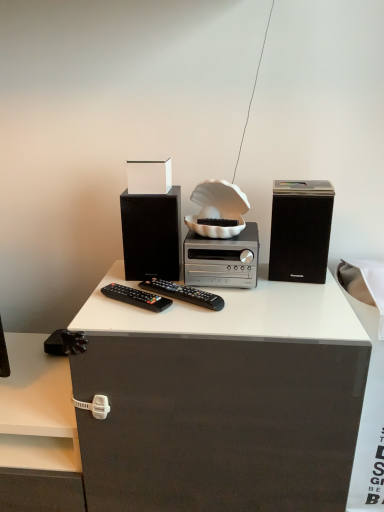
Find the location of a particular element. silver metallic stereo at center is located at coordinates (222, 259).

What do you see at coordinates (183, 293) in the screenshot? I see `black plastic remote at center, placed as the second remote control when sorted from left to right` at bounding box center [183, 293].

Describe the element at coordinates (152, 234) in the screenshot. I see `matte black speaker at center, the first speaker viewed from the left` at that location.

In order to click on silver metallic stereo at center in this screenshot , I will do `click(222, 259)`.

From a real-world perspective, is black plastic remote at center, placed as the second remote control when sorted from left to right, located higher than silver metallic stereo at center?

Incorrect, from a real-world perspective, black plastic remote at center, placed as the second remote control when sorted from left to right, is lower than silver metallic stereo at center.

Could silver metallic stereo at center be considered to be inside black plastic remote at center, placed as the second remote control when sorted from left to right?

Actually, silver metallic stereo at center is outside black plastic remote at center, placed as the second remote control when sorted from left to right.

Considering the positions of points (158, 290) and (223, 264), is point (158, 290) closer to camera compared to point (223, 264)?

No, it is not.

Can you see black plastic remote at center, placed as the second remote control when sorted from left to right, touching silver metallic stereo at center?

Yes, black plastic remote at center, placed as the second remote control when sorted from left to right, and silver metallic stereo at center clearly make contact.

Does point (146, 216) appear closer or farther from the camera than point (278, 216)?

Point (146, 216) is positioned farther from the camera compared to point (278, 216).

From a real-world perspective, is matte black speaker at center, the first speaker viewed from the left, above or below black matte speaker at right, the 1th speaker from the right?

matte black speaker at center, the first speaker viewed from the left, is below black matte speaker at right, the 1th speaker from the right.

Would you say black matte speaker at right, the 1th speaker from the right, is part of matte black speaker at center, which is the second speaker in right-to-left order,'s contents?

Actually, black matte speaker at right, the 1th speaker from the right, is outside matte black speaker at center, which is the second speaker in right-to-left order.

Does matte black speaker at center, which is the second speaker in right-to-left order, turn towards black matte speaker at right, which is the 2th speaker in left-to-right order?

No, matte black speaker at center, which is the second speaker in right-to-left order, is not oriented towards black matte speaker at right, which is the 2th speaker in left-to-right order.

Can you confirm if black plastic remote at center, placed as the second remote control when sorted from left to right, is bigger than black plastic remote at center, which is the 2th remote control in right-to-left order?

Correct, black plastic remote at center, placed as the second remote control when sorted from left to right, is larger in size than black plastic remote at center, which is the 2th remote control in right-to-left order.

From a real-world perspective, who is located lower, black plastic remote at center, marked as the first remote control in a right-to-left arrangement, or black plastic remote at center, the first remote control from the left?

black plastic remote at center, the first remote control from the left, is physically lower.

Which is more to the left, black plastic remote at center, marked as the first remote control in a right-to-left arrangement, or black plastic remote at center, which is the 2th remote control in right-to-left order?

black plastic remote at center, which is the 2th remote control in right-to-left order, is more to the left.

This screenshot has width=384, height=512. Find the location of `remote control behind the black plastic remote at center, marked as the first remote control in a right-to-left arrangement`. remote control behind the black plastic remote at center, marked as the first remote control in a right-to-left arrangement is located at coordinates (136, 297).

Could you tell me if black plastic remote at center, the first remote control from the left, is facing matte black speaker at center, which is the second speaker in right-to-left order?

No, black plastic remote at center, the first remote control from the left, is not facing towards matte black speaker at center, which is the second speaker in right-to-left order.

Choose the correct answer: Is black plastic remote at center, the first remote control from the left, inside matte black speaker at center, the first speaker viewed from the left, or outside it?

black plastic remote at center, the first remote control from the left, is not enclosed by matte black speaker at center, the first speaker viewed from the left.

Considering the relative sizes of black plastic remote at center, the first remote control from the left, and matte black speaker at center, the first speaker viewed from the left, in the image provided, is black plastic remote at center, the first remote control from the left, bigger than matte black speaker at center, the first speaker viewed from the left,?

No.

Based on the photo, from the image's perspective, relative to matte black speaker at center, which is the second speaker in right-to-left order, is black plastic remote at center, the first remote control from the left, above or below?

black plastic remote at center, the first remote control from the left, is below matte black speaker at center, which is the second speaker in right-to-left order.

From a real-world perspective, which is physically below, matte black speaker at center, the first speaker viewed from the left, or matte black cabinet at right?

In real-world perspective, matte black cabinet at right is lower.

Which object is thinner, matte black speaker at center, which is the second speaker in right-to-left order, or matte black cabinet at right?

matte black speaker at center, which is the second speaker in right-to-left order, is thinner.

From the image's perspective, between matte black speaker at center, which is the second speaker in right-to-left order, and matte black cabinet at right, which one is located above?

matte black speaker at center, which is the second speaker in right-to-left order.

Could you tell me if matte black speaker at center, the first speaker viewed from the left, is facing matte black cabinet at right?

No.

Is black plastic remote at center, the first remote control from the left, aimed at black plastic remote at center, marked as the first remote control in a right-to-left arrangement?

No.

Does black plastic remote at center, which is the 2th remote control in right-to-left order, have a lesser height compared to black plastic remote at center, placed as the second remote control when sorted from left to right?

Indeed, black plastic remote at center, which is the 2th remote control in right-to-left order, has a lesser height compared to black plastic remote at center, placed as the second remote control when sorted from left to right.

Looking at the image, does black plastic remote at center, which is the 2th remote control in right-to-left order, seem bigger or smaller compared to black plastic remote at center, placed as the second remote control when sorted from left to right?

Clearly, black plastic remote at center, which is the 2th remote control in right-to-left order, is smaller in size than black plastic remote at center, placed as the second remote control when sorted from left to right.

Would you say silver metallic stereo at center is inside or outside matte black cabinet at right?

silver metallic stereo at center is spatially situated outside matte black cabinet at right.

Looking at this image, can you confirm if silver metallic stereo at center is bigger than matte black cabinet at right?

No, silver metallic stereo at center is not bigger than matte black cabinet at right.

Considering the relative sizes of silver metallic stereo at center and matte black cabinet at right in the image provided, is silver metallic stereo at center shorter than matte black cabinet at right?

Yes.

Is silver metallic stereo at center aimed at matte black cabinet at right?

No, silver metallic stereo at center does not turn towards matte black cabinet at right.

Locate an element on the screen. Image resolution: width=384 pixels, height=512 pixels. the 1st remote control to the left when counting from the silver metallic stereo at center is located at coordinates (183, 293).

You are a GUI agent. You are given a task and a screenshot of the screen. Output one action in this format:
    pyautogui.click(x=<x>, y=<y>)
    Task: Click on the speaker in front of the matte black speaker at center, which is the second speaker in right-to-left order
    The width and height of the screenshot is (384, 512).
    Given the screenshot: What is the action you would take?
    pyautogui.click(x=300, y=230)

Based on their spatial positions, is black matte speaker at right, the 1th speaker from the right, or black plastic remote at center, which is the 2th remote control in right-to-left order, closer to matte black speaker at center, which is the second speaker in right-to-left order?

black plastic remote at center, which is the 2th remote control in right-to-left order.

Looking at the image, which one is located further to black matte speaker at right, the 1th speaker from the right, matte black cabinet at right or matte black speaker at center, which is the second speaker in right-to-left order?

matte black speaker at center, which is the second speaker in right-to-left order, is further to black matte speaker at right, the 1th speaker from the right.

Consider the image. Which object lies nearer to the anchor point silver metallic stereo at center, black plastic remote at center, the first remote control from the left, or matte black cabinet at right?

Based on the image, black plastic remote at center, the first remote control from the left, appears to be nearer to silver metallic stereo at center.

Based on their spatial positions, is black plastic remote at center, the first remote control from the left, or black matte speaker at right, which is the 2th speaker in left-to-right order, further from black plastic remote at center, placed as the second remote control when sorted from left to right?

black matte speaker at right, which is the 2th speaker in left-to-right order, lies further to black plastic remote at center, placed as the second remote control when sorted from left to right, than the other object.

When comparing their distances from matte black cabinet at right, does silver metallic stereo at center or black plastic remote at center, marked as the first remote control in a right-to-left arrangement, seem further?

The object further to matte black cabinet at right is black plastic remote at center, marked as the first remote control in a right-to-left arrangement.

Estimate the real-world distances between objects in this image. Which object is further from black plastic remote at center, which is the 2th remote control in right-to-left order, matte black cabinet at right or black matte speaker at right, the 1th speaker from the right?

matte black cabinet at right lies further to black plastic remote at center, which is the 2th remote control in right-to-left order, than the other object.

From the image, which object appears to be farther from black plastic remote at center, which is the 2th remote control in right-to-left order, silver metallic stereo at center or matte black cabinet at right?

matte black cabinet at right is positioned further to the anchor black plastic remote at center, which is the 2th remote control in right-to-left order.

Looking at the image, which one is located further to matte black cabinet at right, silver metallic stereo at center or black plastic remote at center, the first remote control from the left?

Among the two, black plastic remote at center, the first remote control from the left, is located further to matte black cabinet at right.

Locate an element on the screen. Image resolution: width=384 pixels, height=512 pixels. speaker between black plastic remote at center, the first remote control from the left, and black matte speaker at right, which is the 2th speaker in left-to-right order, in the horizontal direction is located at coordinates (152, 234).

The width and height of the screenshot is (384, 512). What are the coordinates of `speaker between matte black speaker at center, the first speaker viewed from the left, and matte black cabinet at right` in the screenshot? It's located at (300, 230).

The image size is (384, 512). Find the location of `home appliance between black plastic remote at center, marked as the first remote control in a right-to-left arrangement, and matte black cabinet at right from left to right`. home appliance between black plastic remote at center, marked as the first remote control in a right-to-left arrangement, and matte black cabinet at right from left to right is located at coordinates (222, 259).

Find the location of a particular element. The height and width of the screenshot is (512, 384). home appliance between black plastic remote at center, the first remote control from the left, and black matte speaker at right, which is the 2th speaker in left-to-right order, in the horizontal direction is located at coordinates (222, 259).